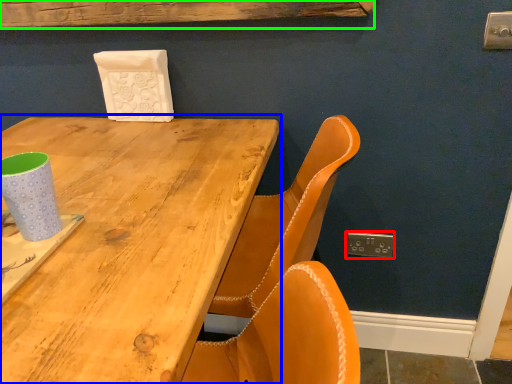
Question: Which object is positioned closest to electric outlet (highlighted by a red box)? Select from table (highlighted by a blue box) and plank (highlighted by a green box).

Choices:
 (A) table
 (B) plank

Answer: (A)